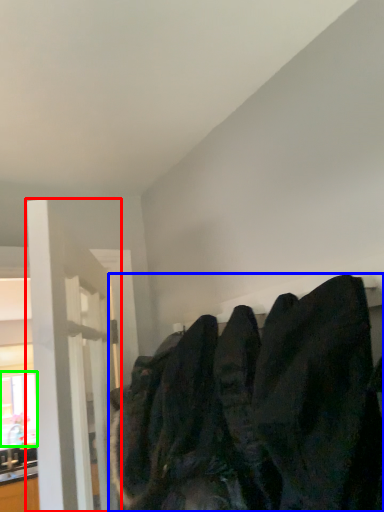
Question: Which object is the farthest from door (highlighted by a red box)? Choose among these: sweatshirt (highlighted by a blue box) or window (highlighted by a green box).

Choices:
 (A) sweatshirt
 (B) window

Answer: (B)